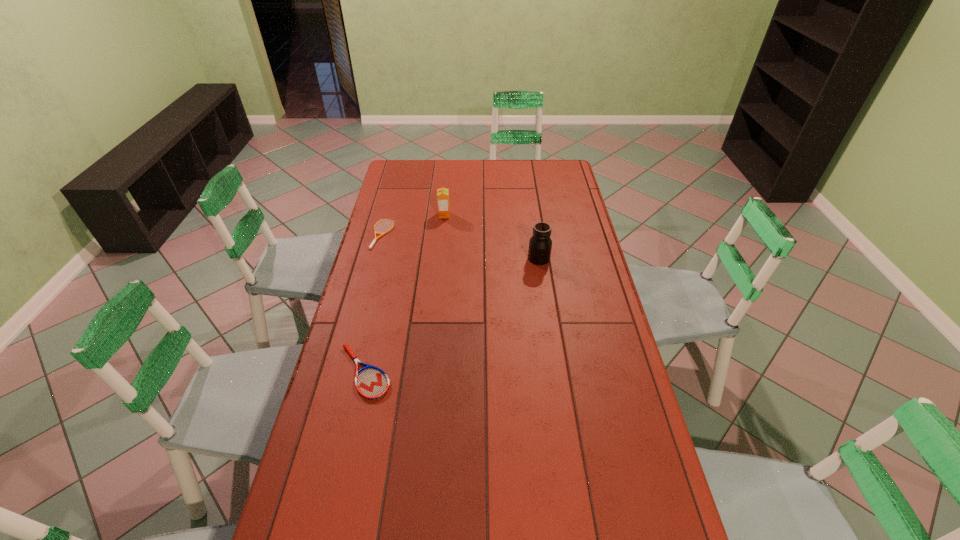
Where is `vacant space located 0.100m on the front of the nearer tennis racket`? This screenshot has height=540, width=960. vacant space located 0.100m on the front of the nearer tennis racket is located at coordinates (351, 433).

At what (x,y) coordinates should I click in order to perform the action: click on vacant area located 0.390m on the front of the farther tennis racket. Please return your answer as a coordinate pair (x, y). This screenshot has width=960, height=540. Looking at the image, I should click on (360, 322).

This screenshot has width=960, height=540. Identify the location of vacant point at the far edge. (451, 179).

This screenshot has height=540, width=960. In the image, there is a desktop. What are the coordinates of `vacant space at the left edge` in the screenshot? It's located at (396, 188).

The image size is (960, 540). I want to click on free space at the right edge of the desktop, so click(x=575, y=257).

This screenshot has width=960, height=540. Identify the location of free space at the far right corner of the desktop. (548, 177).

The image size is (960, 540). What are the coordinates of `vacant space that's between the rightmost object and the third nearest object` in the screenshot? It's located at (461, 246).

Find the location of a particular element. The height and width of the screenshot is (540, 960). free space that is in between the shorter tennis racket and the taller tennis racket is located at coordinates (373, 303).

Locate an element on the screen. vacant area that lies between the shorter tennis racket and the second shortest object is located at coordinates (373, 303).

Where is `free space between the shorter tennis racket and the taller tennis racket`? This screenshot has width=960, height=540. free space between the shorter tennis racket and the taller tennis racket is located at coordinates (373, 303).